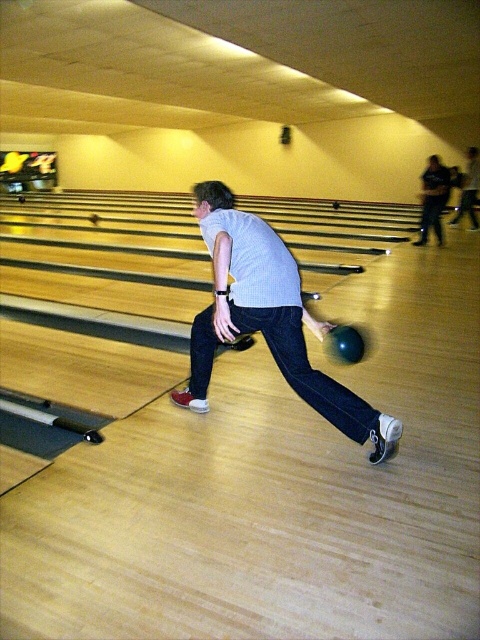
Question: Is matte gray shirt at center to the right of dark blue jeans at upper right from the viewer's perspective?

Choices:
 (A) yes
 (B) no

Answer: (B)

Question: Is dark blue jeans at upper right to the right of shiny blue bowling ball at center from the viewer's perspective?

Choices:
 (A) no
 (B) yes

Answer: (B)

Question: Which object is the closest to the matte gray shirt at center?

Choices:
 (A) dark blue jeans at upper right
 (B) dark gray shirt at center
 (C) shiny blue bowling ball at center

Answer: (C)

Question: Which point is closer to the camera taking this photo?

Choices:
 (A) (437, 192)
 (B) (330, 349)

Answer: (B)

Question: Is matte gray shirt at center below shiny blue bowling ball at center?

Choices:
 (A) no
 (B) yes

Answer: (B)

Question: Which object is farther from the camera taking this photo?

Choices:
 (A) dark gray shirt at center
 (B) shiny blue bowling ball at center
 (C) matte gray shirt at center
 (D) dark blue jeans at upper right

Answer: (A)